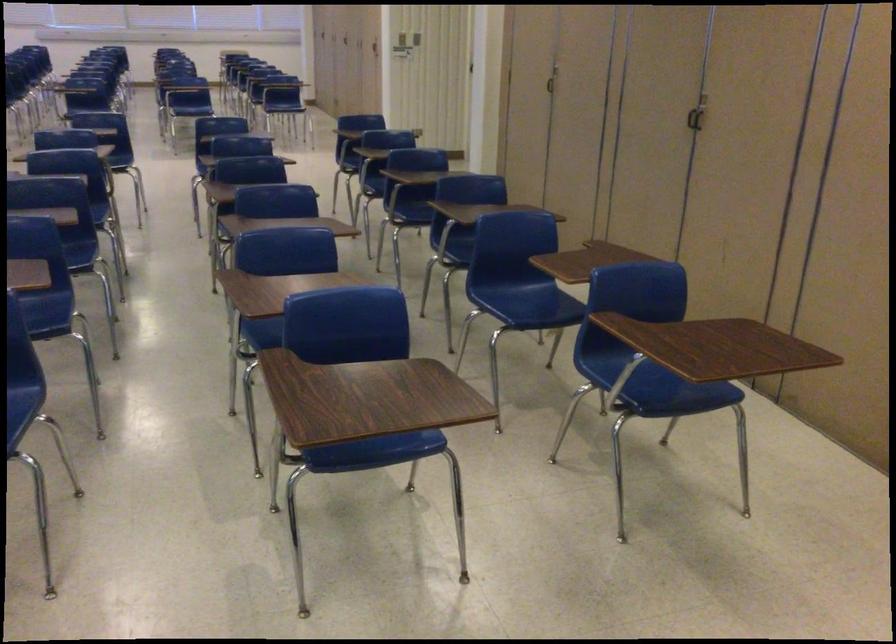
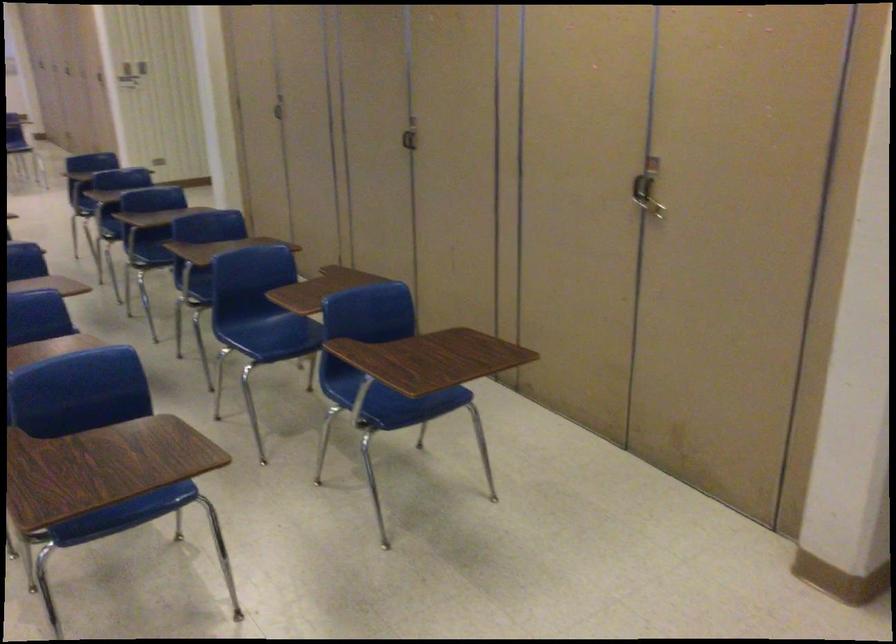
Find the pixel in the second image that matches point 550,84 in the first image.

(279, 107)